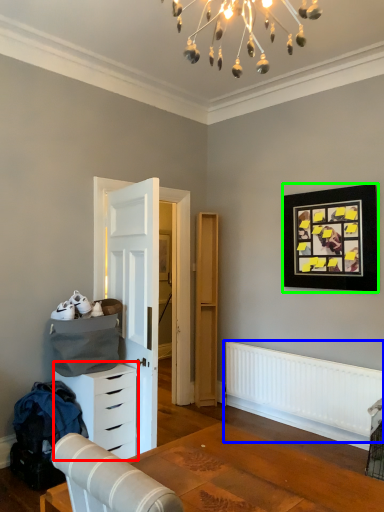
Question: Estimate the real-world distances between objects in this image. Which object is farther from chest of drawers (highlighted by a red box), radiator (highlighted by a blue box) or picture frame (highlighted by a green box)?

Choices:
 (A) radiator
 (B) picture frame

Answer: (B)